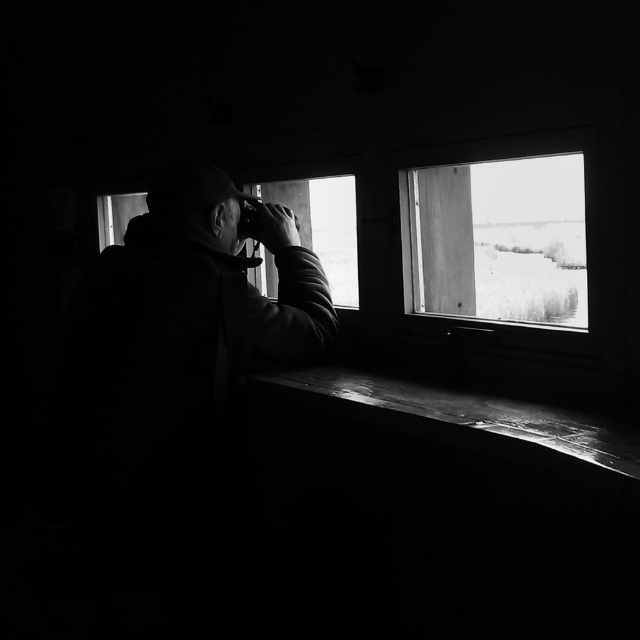
Who is positioned more to the right, clear glass window at upper right or transparent glass window at center?

clear glass window at upper right

Does clear glass window at upper right appear on the left side of transparent glass window at center?

In fact, clear glass window at upper right is to the right of transparent glass window at center.

Does point (561, 198) lie in front of point (307, 221)?

No, it is behind (307, 221).

I want to click on clear glass window at upper right, so click(x=497, y=241).

Does clear glass window at upper right appear over smooth wood window sill at lower center?

Yes, clear glass window at upper right is above smooth wood window sill at lower center.

Between clear glass window at upper right and smooth wood window sill at lower center, which one is positioned higher?

Positioned higher is clear glass window at upper right.

Where is `clear glass window at upper right`? clear glass window at upper right is located at coordinates (497, 241).

Measure the distance between smooth wood window sill at lower center and camera.

A distance of 1.05 meters exists between smooth wood window sill at lower center and camera.

Is smooth wood window sill at lower center below transparent glass window at center?

Yes, smooth wood window sill at lower center is below transparent glass window at center.

Between point (458, 424) and point (349, 275), which one is positioned behind?

The point (349, 275) is behind.

This screenshot has width=640, height=640. In order to click on smooth wood window sill at lower center in this screenshot , I will do `click(477, 422)`.